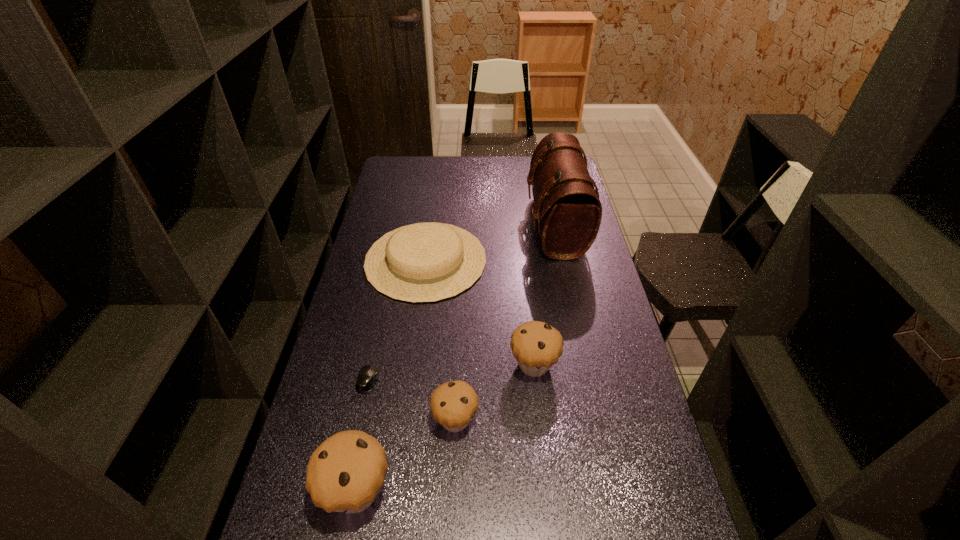
Locate an element on the screen. The height and width of the screenshot is (540, 960). vacant space situated on the back of the second muffin from right to left is located at coordinates (461, 296).

This screenshot has height=540, width=960. I want to click on blank space located on the back of the fourth shortest object, so click(525, 284).

I want to click on free space located on the right of the sunhat, so click(535, 260).

At what (x,y) coordinates should I click in order to perform the action: click on free space located 0.060m on the front-facing side of the tallest object. Please return your answer as a coordinate pair (x, y). This screenshot has width=960, height=540. Looking at the image, I should click on (512, 226).

Image resolution: width=960 pixels, height=540 pixels. I want to click on vacant space located 0.300m on the front-facing side of the tallest object, so click(x=453, y=226).

Locate an element on the screen. blank area located 0.360m on the front-facing side of the tallest object is located at coordinates (439, 226).

I want to click on vacant space located on the back of the shortest object, so click(377, 338).

Where is `object situated at the near edge`? Image resolution: width=960 pixels, height=540 pixels. object situated at the near edge is located at coordinates (345, 473).

At what (x,y) coordinates should I click in order to perform the action: click on muffin that is at the left edge. Please return your answer as a coordinate pair (x, y). Looking at the image, I should click on (345, 473).

Find the location of a particular element. This screenshot has height=540, width=960. sunhat at the left edge is located at coordinates (424, 262).